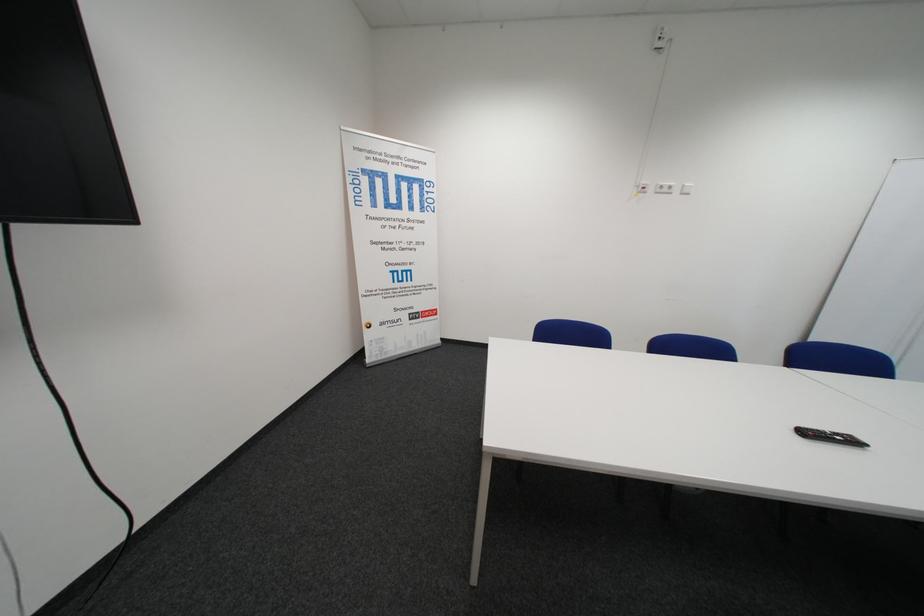
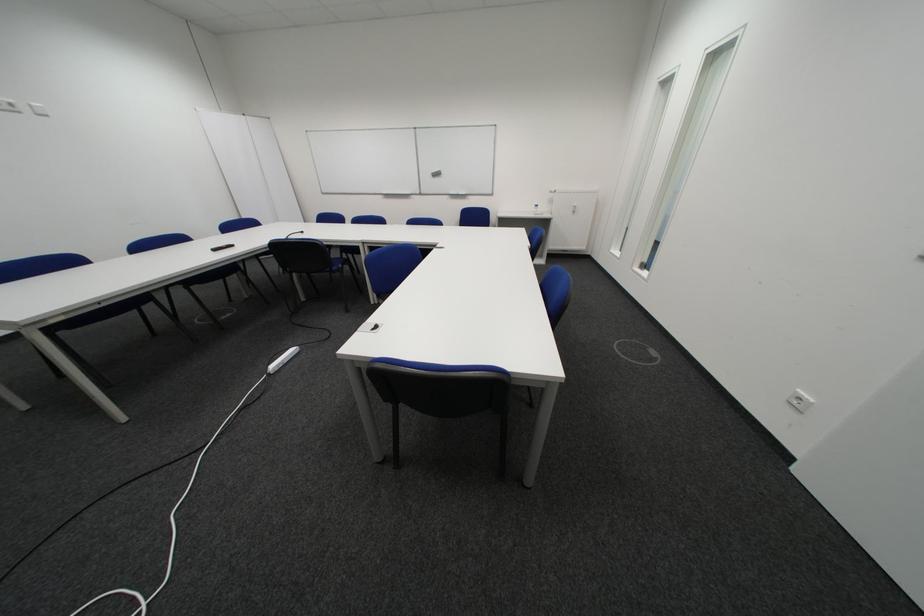
Find the pixel in the second image that matches [671,192] in the first image.

(8, 108)